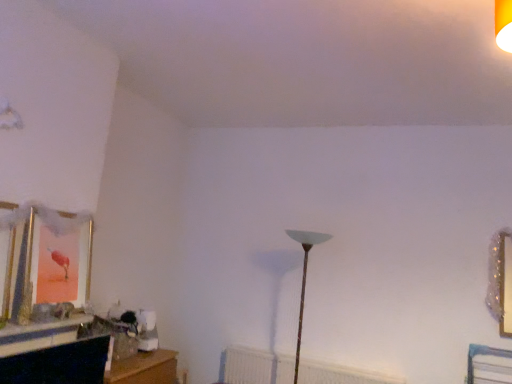
Question: Does white textured radiator at center come in front of translucent glass lamp at center?

Choices:
 (A) yes
 (B) no

Answer: (B)

Question: Does white textured radiator at center have a greater width compared to translucent glass lamp at center?

Choices:
 (A) no
 (B) yes

Answer: (A)

Question: Does white textured radiator at center appear on the right side of translucent glass lamp at center?

Choices:
 (A) no
 (B) yes

Answer: (B)

Question: Is white textured radiator at center to the left of translucent glass lamp at center from the viewer's perspective?

Choices:
 (A) no
 (B) yes

Answer: (A)

Question: Does white textured radiator at center turn towards translucent glass lamp at center?

Choices:
 (A) yes
 (B) no

Answer: (B)

Question: From the image's perspective, is white textured radiator at center over translucent glass lamp at center?

Choices:
 (A) yes
 (B) no

Answer: (B)

Question: From the image's perspective, is translucent glass lamp at center over white textured radiator at center?

Choices:
 (A) no
 (B) yes

Answer: (B)

Question: Is translucent glass lamp at center looking in the opposite direction of white textured radiator at center?

Choices:
 (A) no
 (B) yes

Answer: (B)

Question: Considering the relative sizes of translucent glass lamp at center and white textured radiator at center in the image provided, is translucent glass lamp at center wider than white textured radiator at center?

Choices:
 (A) no
 (B) yes

Answer: (B)

Question: From the image's perspective, is translucent glass lamp at center located beneath white textured radiator at center?

Choices:
 (A) no
 (B) yes

Answer: (A)

Question: From a real-world perspective, does translucent glass lamp at center stand above white textured radiator at center?

Choices:
 (A) no
 (B) yes

Answer: (B)

Question: Does translucent glass lamp at center touch white textured radiator at center?

Choices:
 (A) yes
 (B) no

Answer: (B)

Question: Would you say translucent glass lamp at center is to the left or to the right of white textured radiator at center in the picture?

Choices:
 (A) right
 (B) left

Answer: (B)